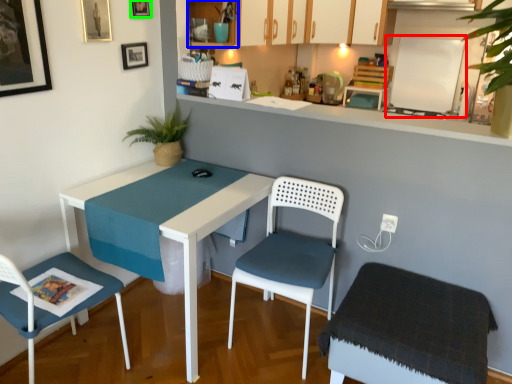
Question: Estimate the real-world distances between objects in this image. Which object is closer to bulletin board (highlighted by a red box), cabinetry (highlighted by a blue box) or picture frame (highlighted by a green box)?

Choices:
 (A) cabinetry
 (B) picture frame

Answer: (A)